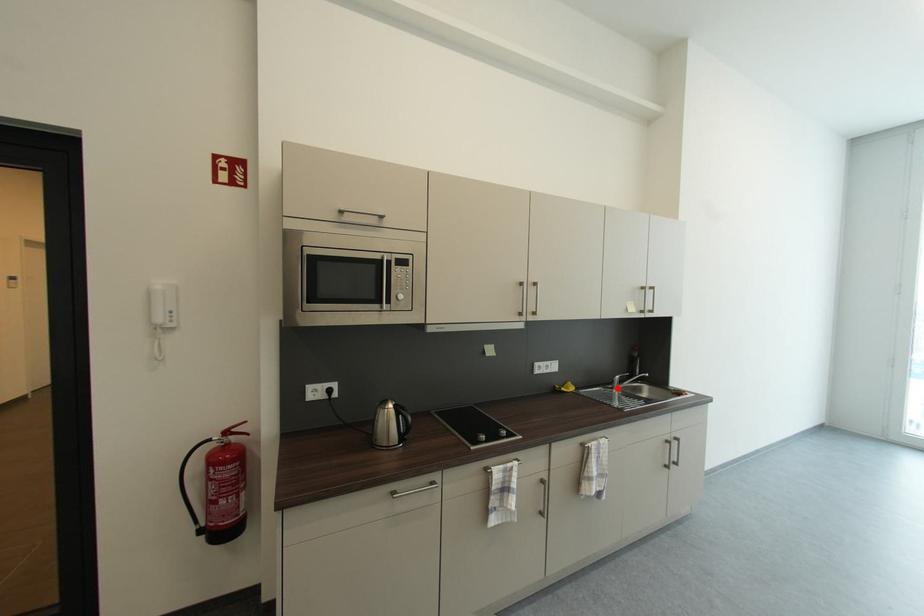
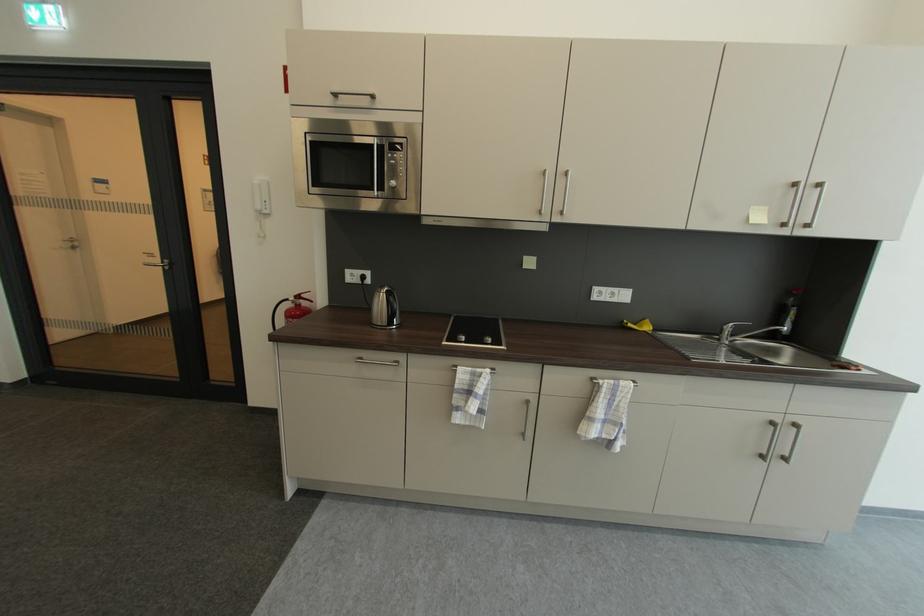
Question: I am providing you with two images of the same scene from different viewpoints. A red point is marked on the first image. At the location where the point appears in image 1, is it still visible in image 2?

Choices:
 (A) Yes
 (B) No

Answer: (A)